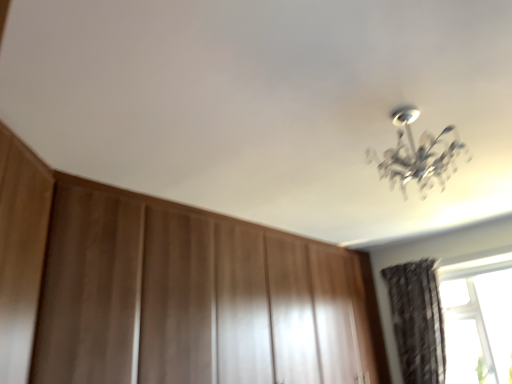
Question: Could you tell me if wooden dresser at center is facing dark textured curtain at lower right?

Choices:
 (A) yes
 (B) no

Answer: (A)

Question: Does wooden dresser at center have a smaller size compared to dark textured curtain at lower right?

Choices:
 (A) yes
 (B) no

Answer: (B)

Question: From the image's perspective, is wooden dresser at center below dark textured curtain at lower right?

Choices:
 (A) no
 (B) yes

Answer: (A)

Question: Is wooden dresser at center at the right side of dark textured curtain at lower right?

Choices:
 (A) yes
 (B) no

Answer: (B)

Question: Are wooden dresser at center and dark textured curtain at lower right far apart?

Choices:
 (A) yes
 (B) no

Answer: (A)

Question: Considering the relative sizes of wooden dresser at center and dark textured curtain at lower right in the image provided, is wooden dresser at center thinner than dark textured curtain at lower right?

Choices:
 (A) yes
 (B) no

Answer: (B)

Question: Is dark textured curtain at lower right smaller than wooden dresser at center?

Choices:
 (A) no
 (B) yes

Answer: (B)

Question: Does dark textured curtain at lower right have a larger size compared to wooden dresser at center?

Choices:
 (A) yes
 (B) no

Answer: (B)

Question: From a real-world perspective, is dark textured curtain at lower right under wooden dresser at center?

Choices:
 (A) yes
 (B) no

Answer: (A)

Question: Is wooden dresser at center surrounded by dark textured curtain at lower right?

Choices:
 (A) no
 (B) yes

Answer: (A)

Question: Can you confirm if dark textured curtain at lower right is taller than wooden dresser at center?

Choices:
 (A) yes
 (B) no

Answer: (B)

Question: Is the position of dark textured curtain at lower right less distant than that of wooden dresser at center?

Choices:
 (A) no
 (B) yes

Answer: (A)

Question: Choose the correct answer: Is dark textured curtain at lower right inside wooden dresser at center or outside it?

Choices:
 (A) outside
 (B) inside

Answer: (B)